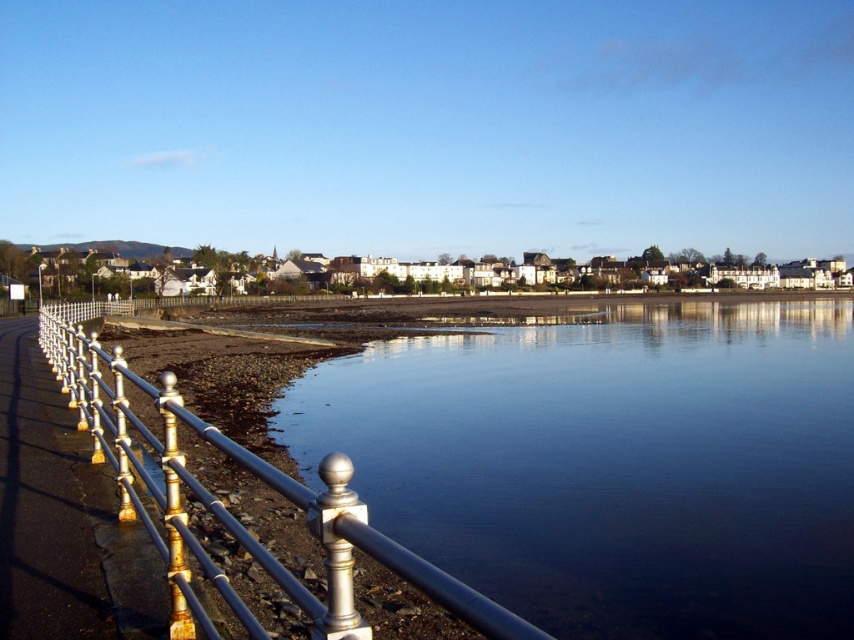
Question: Is clear glass water at center positioned before silver/golden metal fence at left?

Choices:
 (A) no
 (B) yes

Answer: (A)

Question: Is clear glass water at center to the right of metallic rail at left from the viewer's perspective?

Choices:
 (A) no
 (B) yes

Answer: (B)

Question: Is silver/golden metal fence at left above metallic rail at left?

Choices:
 (A) yes
 (B) no

Answer: (B)

Question: Which point is farther to the camera?

Choices:
 (A) (553, 637)
 (B) (773, 484)

Answer: (B)

Question: Which object is the farthest from the silver/golden metal fence at left?

Choices:
 (A) metallic rail at left
 (B) clear glass water at center

Answer: (B)

Question: Among these objects, which one is nearest to the camera?

Choices:
 (A) silver/golden metal fence at left
 (B) clear glass water at center
 (C) metallic rail at left

Answer: (A)